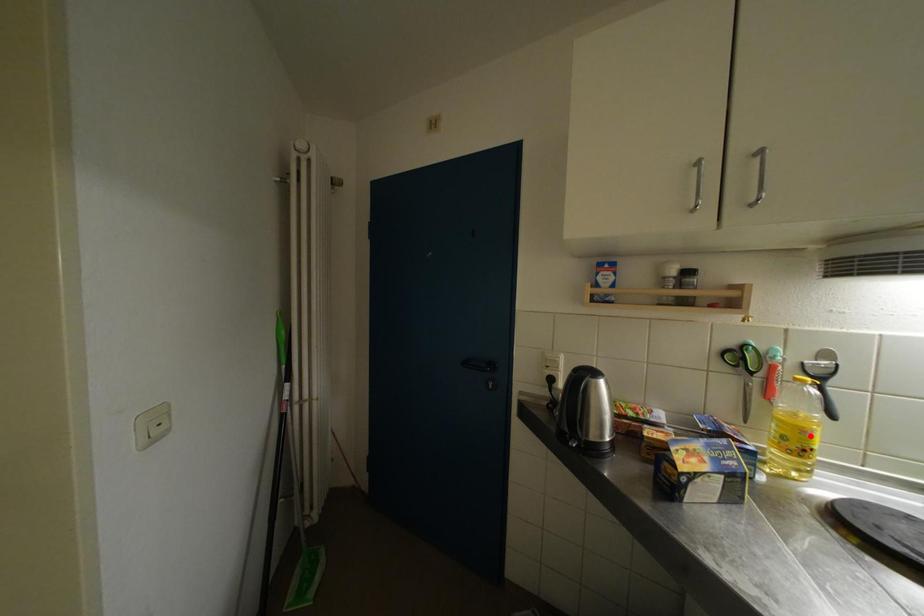
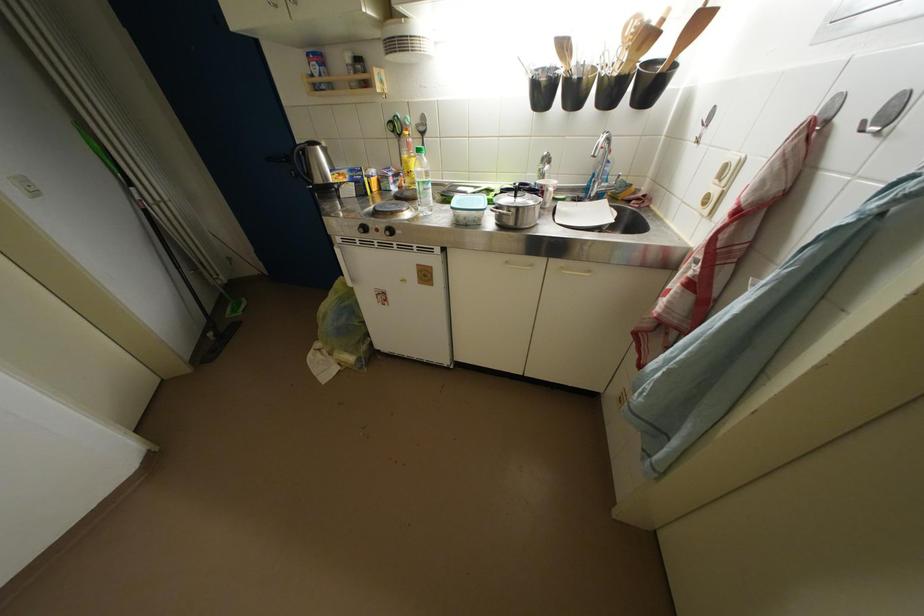
The point at the highlighted location is marked in the first image. Where is the corresponding point in the second image?

(412, 167)